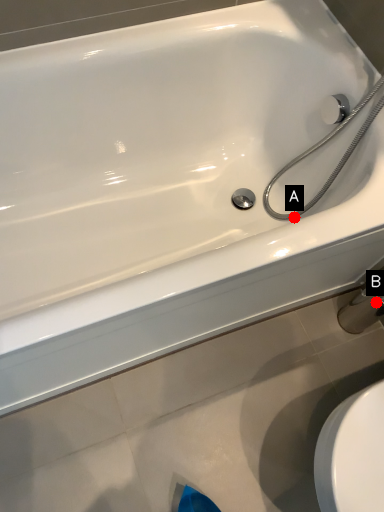
Question: Two points are circled on the image, labeled by A and B beside each circle. Which point is closer to the camera?

Choices:
 (A) A is closer
 (B) B is closer

Answer: (A)